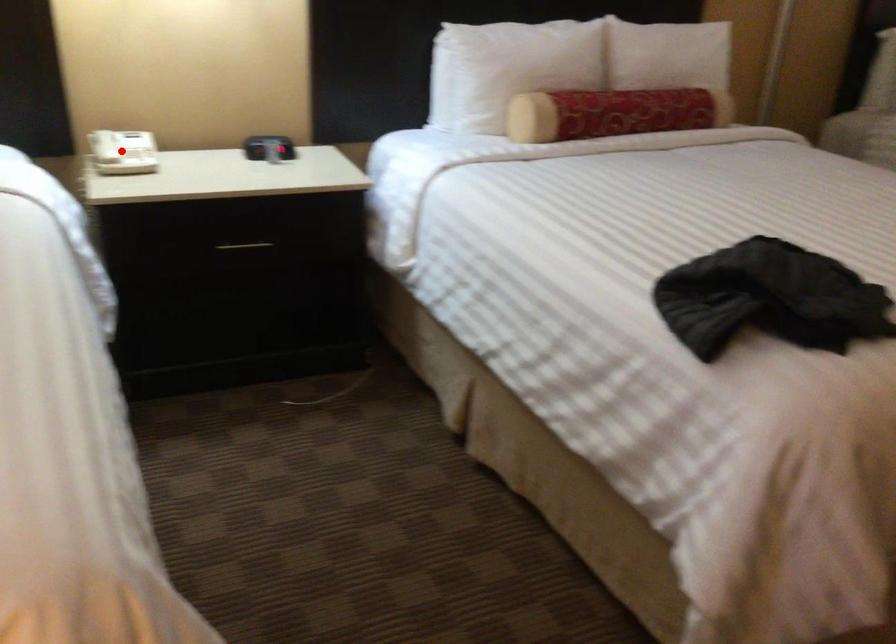
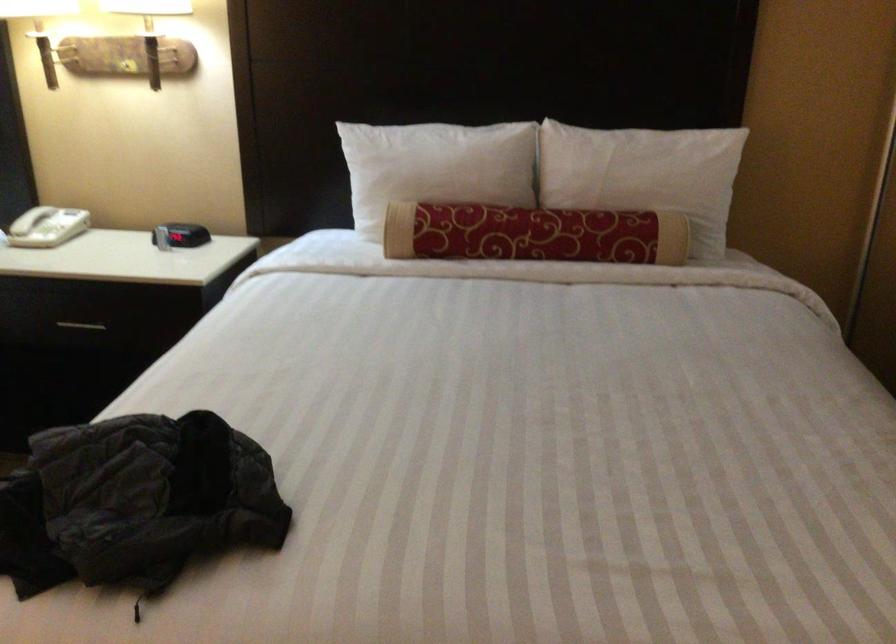
Where in the second image is the point corresponding to the highlighted location from the first image?

(30, 220)